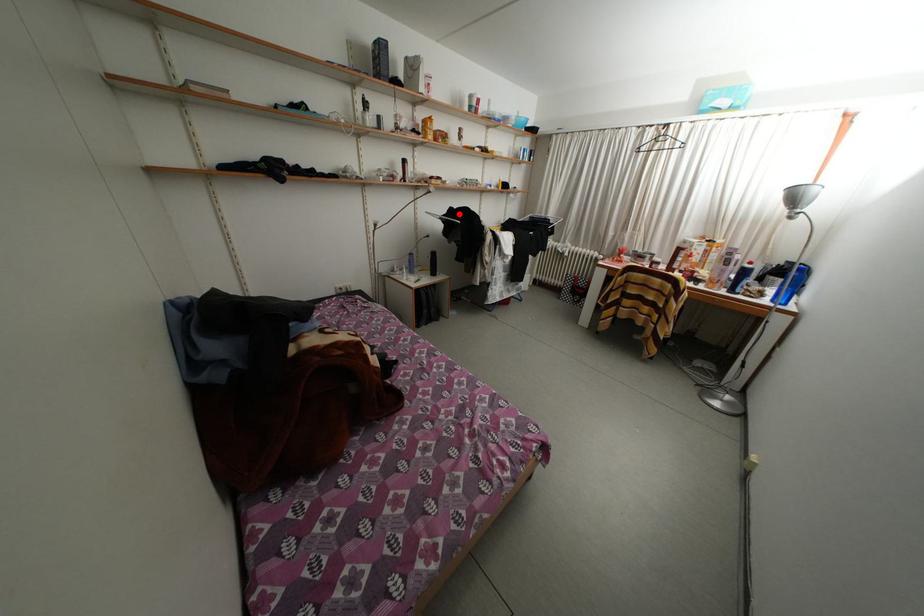
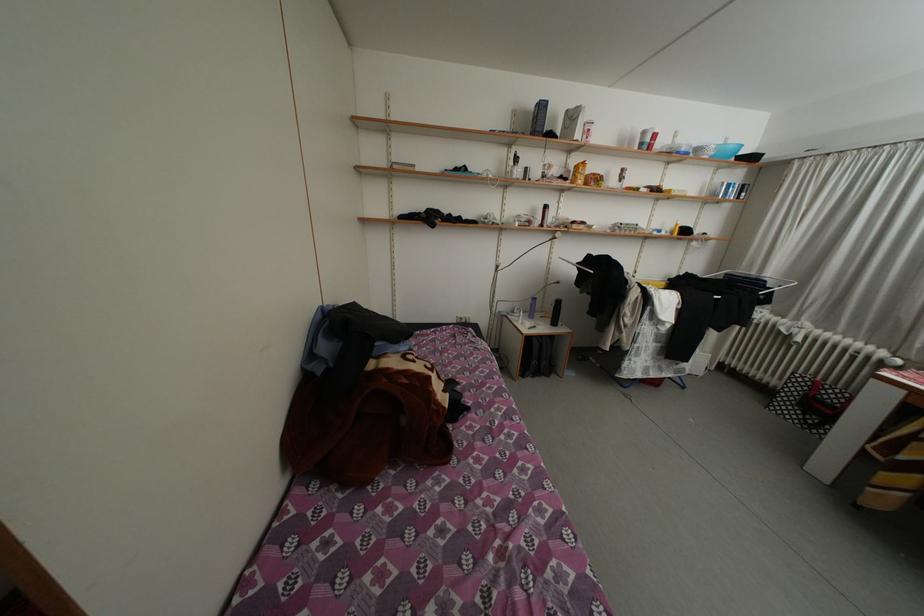
Where in the second image is the point corresponding to the highlighted location from the first image?

(597, 262)